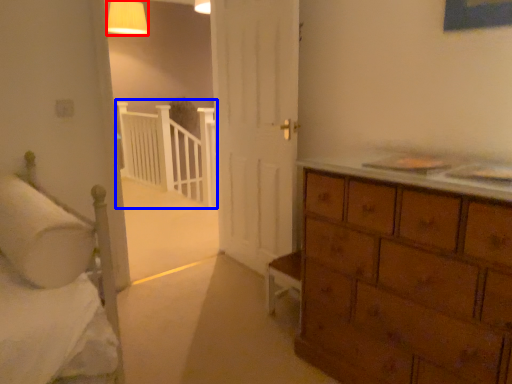
Question: Which object is further to the camera taking this photo, lighting (highlighted by a red box) or balustrade (highlighted by a blue box)?

Choices:
 (A) lighting
 (B) balustrade

Answer: (B)